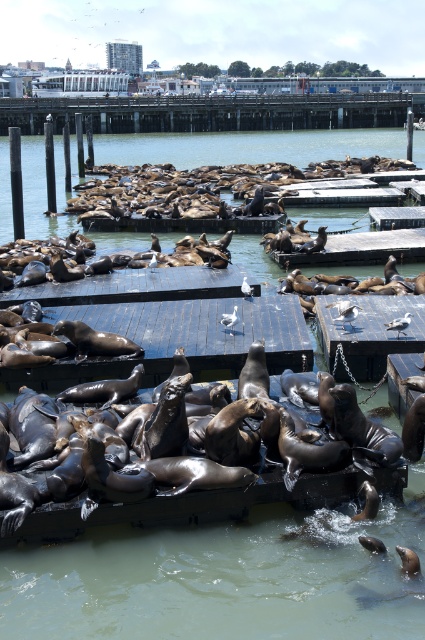
Question: Among these objects, which one is farthest from the camera?

Choices:
 (A) wooden dock at center
 (B) black wood dock at center
 (C) smooth wooden dock at upper center

Answer: (C)

Question: Which of these objects is positioned farthest from the wooden dock at center?

Choices:
 (A) smooth wooden dock at upper center
 (B) black wood dock at center

Answer: (A)

Question: Where is smooth wooden dock at upper center located in relation to black wood dock at center in the image?

Choices:
 (A) left
 (B) right

Answer: (B)

Question: Is wooden dock at center closer to camera compared to black wood dock at center?

Choices:
 (A) no
 (B) yes

Answer: (B)

Question: Which point is closer to the camera?

Choices:
 (A) (244, 124)
 (B) (139, 275)
 (C) (119, 371)

Answer: (C)

Question: Can you confirm if wooden dock at center is smaller than smooth wooden dock at upper center?

Choices:
 (A) yes
 (B) no

Answer: (A)